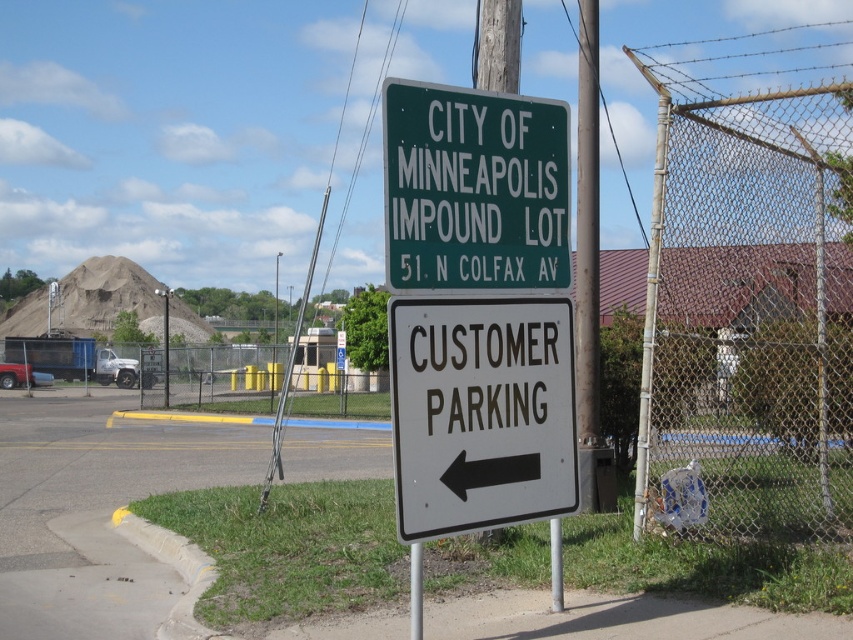
Question: Which object appears farthest from the camera in this image?

Choices:
 (A) white plastic sign at center
 (B) green metal sign at upper center

Answer: (B)

Question: Is white plastic sign at center in front of green metal sign at upper center?

Choices:
 (A) yes
 (B) no

Answer: (A)

Question: Which of these objects is positioned farthest from the wire mesh fence at right?

Choices:
 (A) green metal sign at upper center
 (B) white plastic sign at center

Answer: (A)

Question: Which object appears closest to the camera in this image?

Choices:
 (A) white plastic sign at center
 (B) green metal sign at upper center

Answer: (A)

Question: Is wire mesh fence at right thinner than white plastic sign at center?

Choices:
 (A) yes
 (B) no

Answer: (B)

Question: From the image, what is the correct spatial relationship of white plastic sign at center in relation to green metal sign at upper center?

Choices:
 (A) below
 (B) above

Answer: (A)